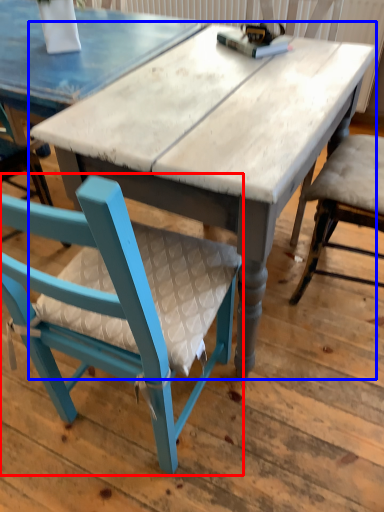
Question: Which of the following is the farthest to the observer, chair (highlighted by a red box) or table (highlighted by a blue box)?

Choices:
 (A) chair
 (B) table

Answer: (B)